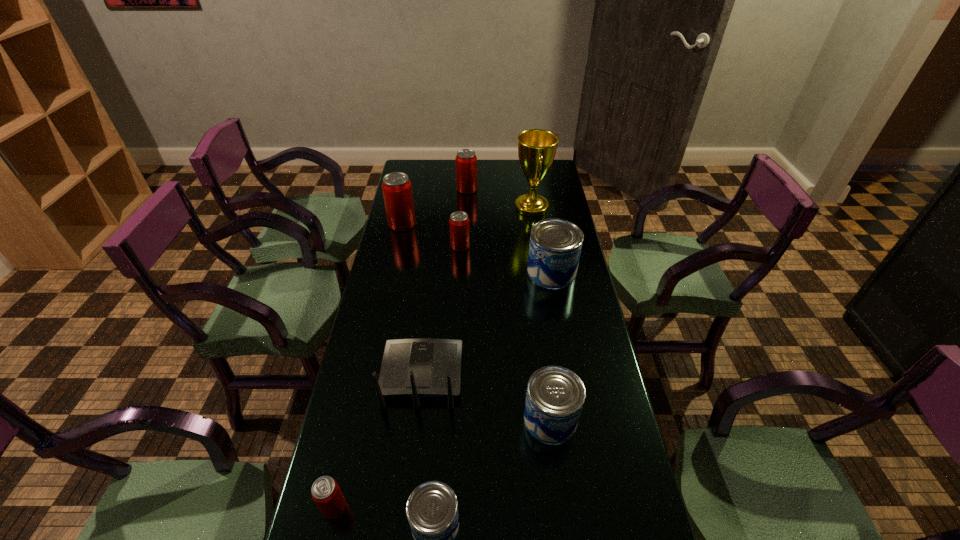
Select which red can is the third closest to the farthest can. Please provide its 2D coordinates. Your answer should be formatted as a tuple, i.e. [(x, y)], where the tuple contains the x and y coordinates of a point satisfying the conditions above.

[(326, 493)]

Select which blue can appears as the second closest to the tallest can. Please provide its 2D coordinates. Your answer should be formatted as a tuple, i.e. [(x, y)], where the tuple contains the x and y coordinates of a point satisfying the conditions above.

[(555, 395)]

Find the location of a particular element. The height and width of the screenshot is (540, 960). the closest blue can to the gold award is located at coordinates (555, 246).

Find the location of a particular element. The width and height of the screenshot is (960, 540). free space that satisfies the following two spatial constraints: 1. by the handles of the tallest object; 2. on the front side of the third farthest red can is located at coordinates (538, 246).

You are a GUI agent. You are given a task and a screenshot of the screen. Output one action in this format:
    pyautogui.click(x=<x>, y=<y>)
    Task: Click on the free region that satisfies the following two spatial constraints: 1. on the front-facing side of the sixth nearest object; 2. on the left side of the router
    This screenshot has width=960, height=540.
    Given the screenshot: What is the action you would take?
    (437, 246)